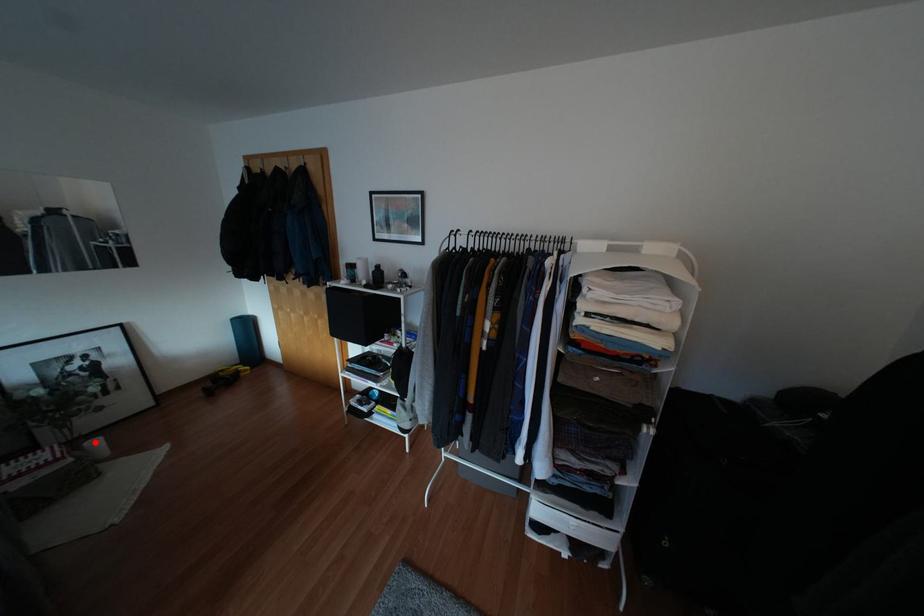
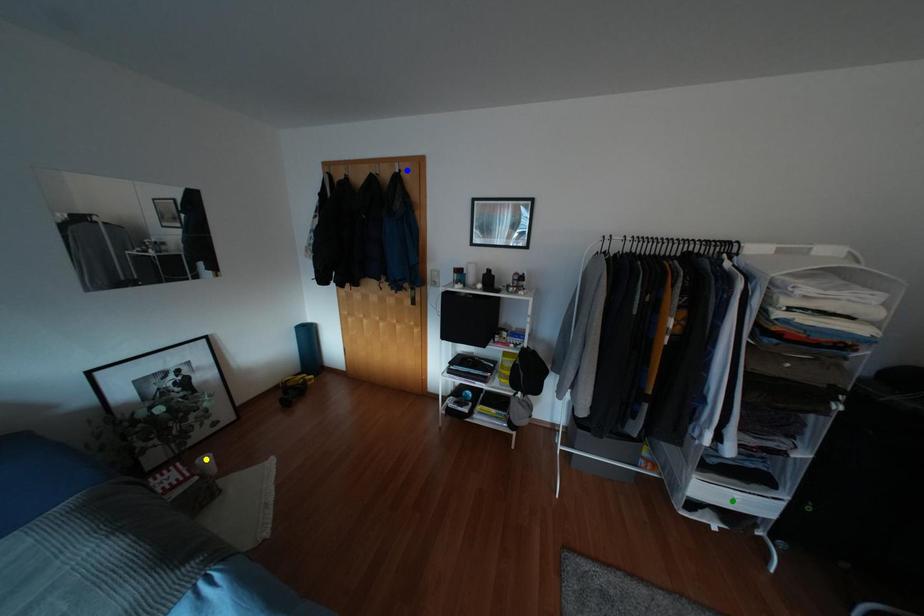
Question: I am providing you with two images of the same scene from different viewpoints. A red point is marked on the first image. You are given multiple points on the second image. Which mark in image 2 goes with the point in image 1?

Choices:
 (A) yellow point
 (B) blue point
 (C) green point

Answer: (A)